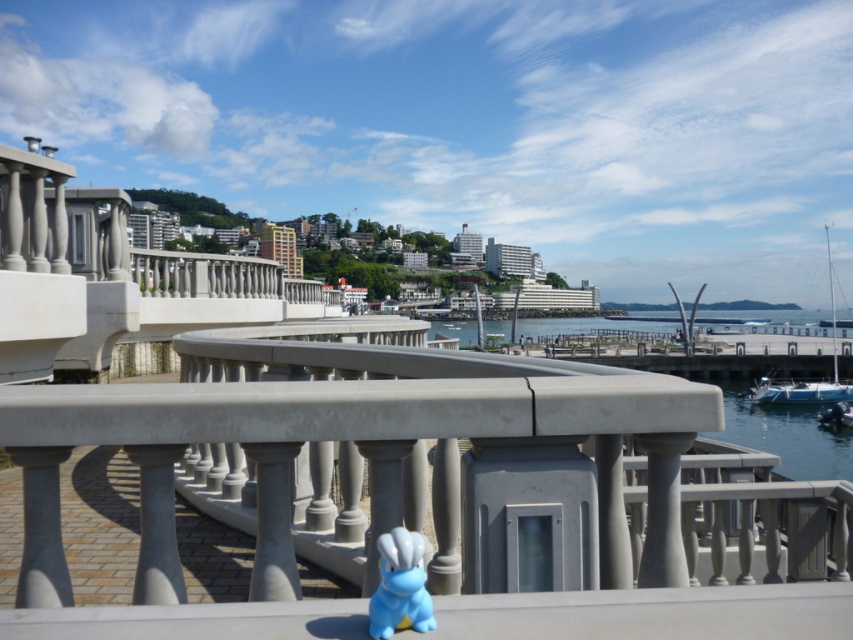
Can you confirm if clear water at center is positioned below white glossy boat at right?

Yes.

Is point (440, 324) farther from camera compared to point (807, 387)?

That is True.

Is point (585, 346) positioned behind point (782, 400)?

Yes, it is behind point (782, 400).

Where is `clear water at center`? The image size is (853, 640). clear water at center is located at coordinates (764, 410).

The height and width of the screenshot is (640, 853). What do you see at coordinates (399, 586) in the screenshot?
I see `blue rubber duck at center` at bounding box center [399, 586].

Which is in front, point (409, 596) or point (769, 403)?

Point (409, 596) is in front.

What are the coordinates of `blue rubber duck at center` in the screenshot? It's located at pos(399,586).

Does blue rubber duck at center have a lesser height compared to blue plastic boat at lower right?

Correct, blue rubber duck at center is not as tall as blue plastic boat at lower right.

Can you confirm if blue rubber duck at center is smaller than blue plastic boat at lower right?

Yes.

Is point (404, 563) behind point (805, 401)?

No.

Find the location of a particular element. The height and width of the screenshot is (640, 853). blue rubber duck at center is located at coordinates click(399, 586).